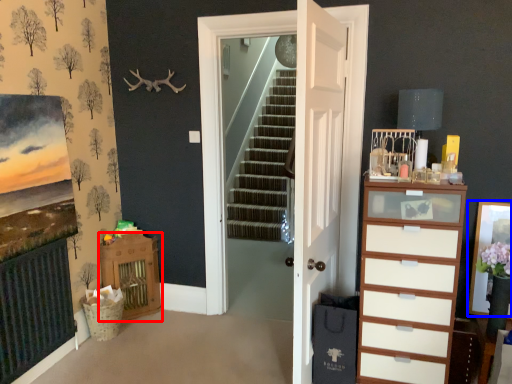
Question: Which point is closer to the camera, vanity (highlighted by a red box) or picture frame (highlighted by a blue box)?

Choices:
 (A) vanity
 (B) picture frame

Answer: (B)